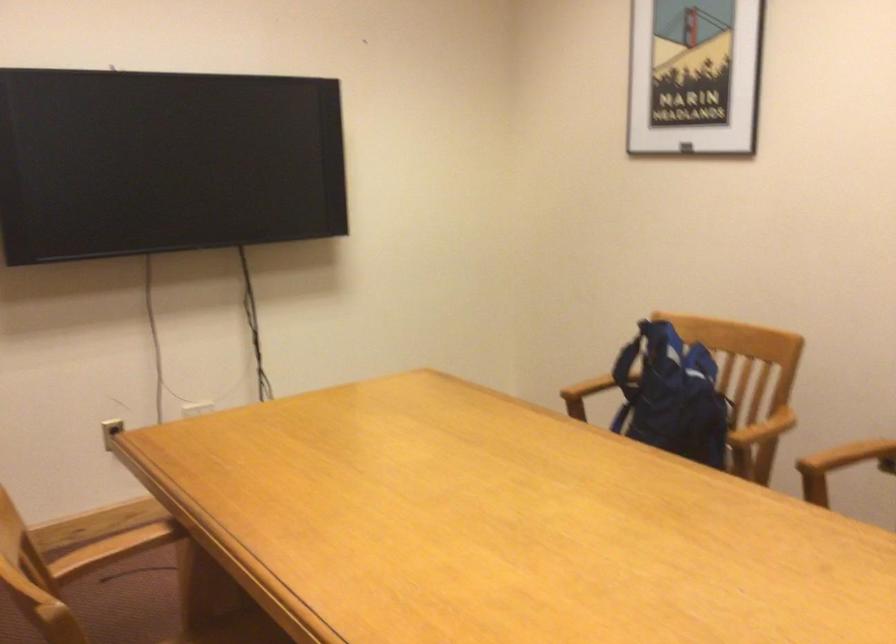
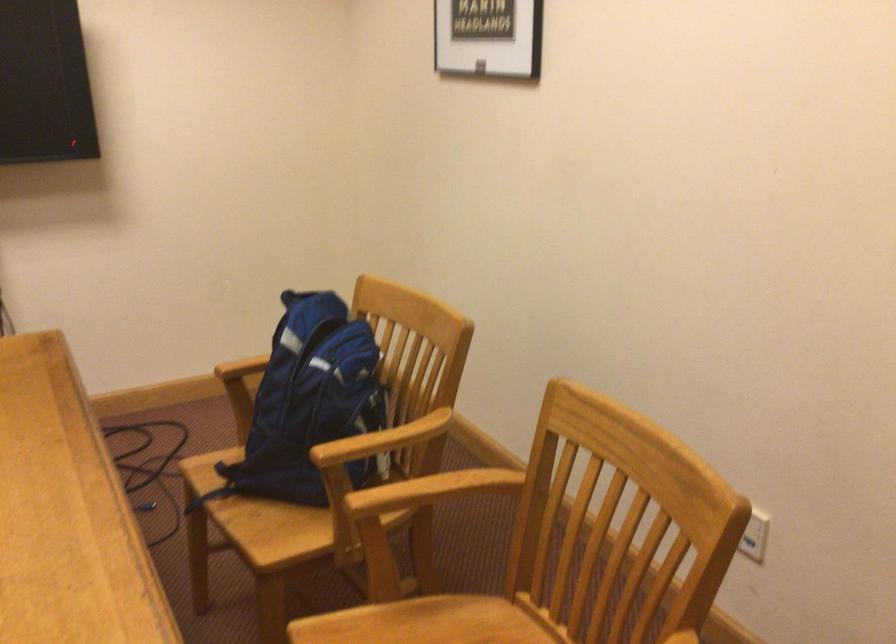
In the second image, find the point that corresponds to point (675, 408) in the first image.

(309, 404)